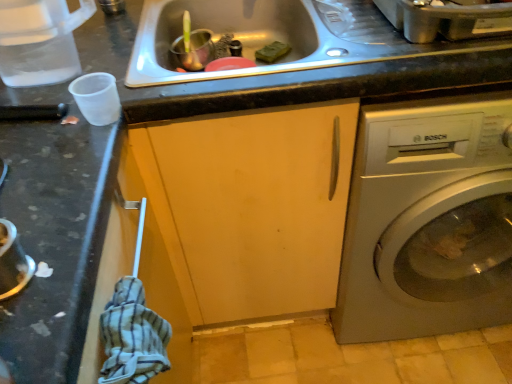
Question: Considering the relative positions of transparent plastic cup at left and matte wood cabinet at center in the image provided, is transparent plastic cup at left to the right of matte wood cabinet at center from the viewer's perspective?

Choices:
 (A) no
 (B) yes

Answer: (A)

Question: Can you confirm if transparent plastic cup at left is thinner than matte wood cabinet at center?

Choices:
 (A) yes
 (B) no

Answer: (A)

Question: Are transparent plastic cup at left and matte wood cabinet at center far apart?

Choices:
 (A) yes
 (B) no

Answer: (B)

Question: Is transparent plastic cup at left oriented towards matte wood cabinet at center?

Choices:
 (A) no
 (B) yes

Answer: (A)

Question: Considering the relative positions of transparent plastic cup at left and matte wood cabinet at center in the image provided, is transparent plastic cup at left to the left of matte wood cabinet at center from the viewer's perspective?

Choices:
 (A) no
 (B) yes

Answer: (B)

Question: Is matte wood cabinet at center taller or shorter than satin silver washing machine at right?

Choices:
 (A) short
 (B) tall

Answer: (B)

Question: From the image's perspective, relative to satin silver washing machine at right, is matte wood cabinet at center above or below?

Choices:
 (A) above
 (B) below

Answer: (B)

Question: Considering their positions, is matte wood cabinet at center located in front of or behind satin silver washing machine at right?

Choices:
 (A) behind
 (B) front

Answer: (A)

Question: Choose the correct answer: Is matte wood cabinet at center inside satin silver washing machine at right or outside it?

Choices:
 (A) inside
 (B) outside

Answer: (B)

Question: Is transparent plastic cup at left to the left or to the right of matte wood cabinet at center in the image?

Choices:
 (A) right
 (B) left

Answer: (B)

Question: From a real-world perspective, relative to matte wood cabinet at center, is transparent plastic cup at left vertically above or below?

Choices:
 (A) below
 (B) above

Answer: (B)

Question: From their relative heights in the image, would you say transparent plastic cup at left is taller or shorter than matte wood cabinet at center?

Choices:
 (A) tall
 (B) short

Answer: (B)

Question: From the image's perspective, is transparent plastic cup at left above or below matte wood cabinet at center?

Choices:
 (A) above
 (B) below

Answer: (A)

Question: From a real-world perspective, relative to transparent plastic cup at left, is stainless steel sink at center vertically above or below?

Choices:
 (A) below
 (B) above

Answer: (A)

Question: From their relative heights in the image, would you say stainless steel sink at center is taller or shorter than transparent plastic cup at left?

Choices:
 (A) tall
 (B) short

Answer: (B)